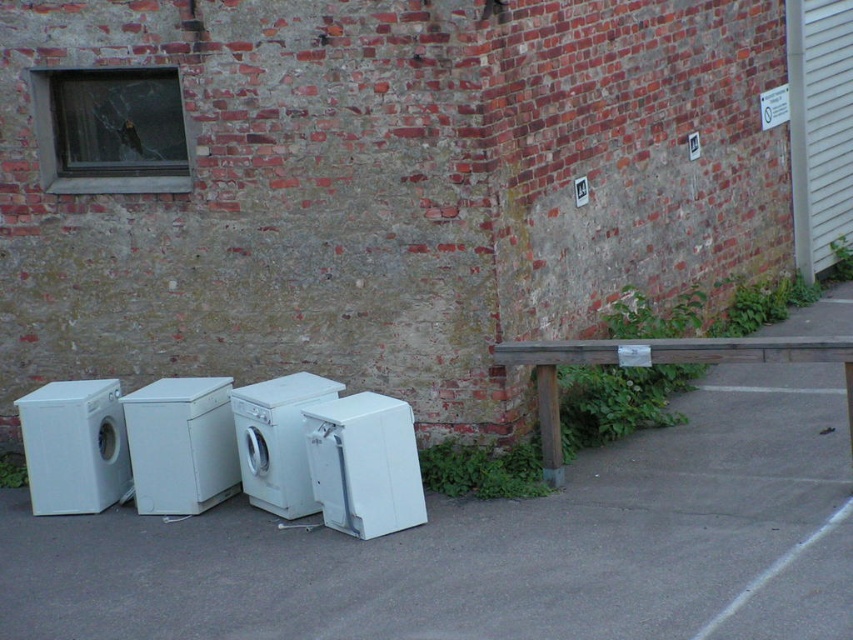
Question: Which of these objects is positioned farthest from the white matte washing machine at center?

Choices:
 (A) white smooth pavement at lower center
 (B) white plastic washing machine at lower center
 (C) wooden picnic table at right
 (D) white glossy washing machine at center

Answer: (C)

Question: Is white plastic washing machine at lower center smaller than wooden picnic table at right?

Choices:
 (A) yes
 (B) no

Answer: (A)

Question: Is white plastic washing machine at lower center positioned before white matte washing machine at center?

Choices:
 (A) yes
 (B) no

Answer: (A)

Question: Which point is farther to the camera?

Choices:
 (A) wooden picnic table at right
 (B) white plastic washing machine at lower center
 (C) white glossy washing machine at center

Answer: (C)

Question: Which of these objects is positioned farthest from the wooden picnic table at right?

Choices:
 (A) white matte washing machine at center
 (B) white matte washing machine at left
 (C) white glossy washing machine at center

Answer: (B)

Question: Can you confirm if white glossy washing machine at center is thinner than white matte washing machine at center?

Choices:
 (A) yes
 (B) no

Answer: (A)